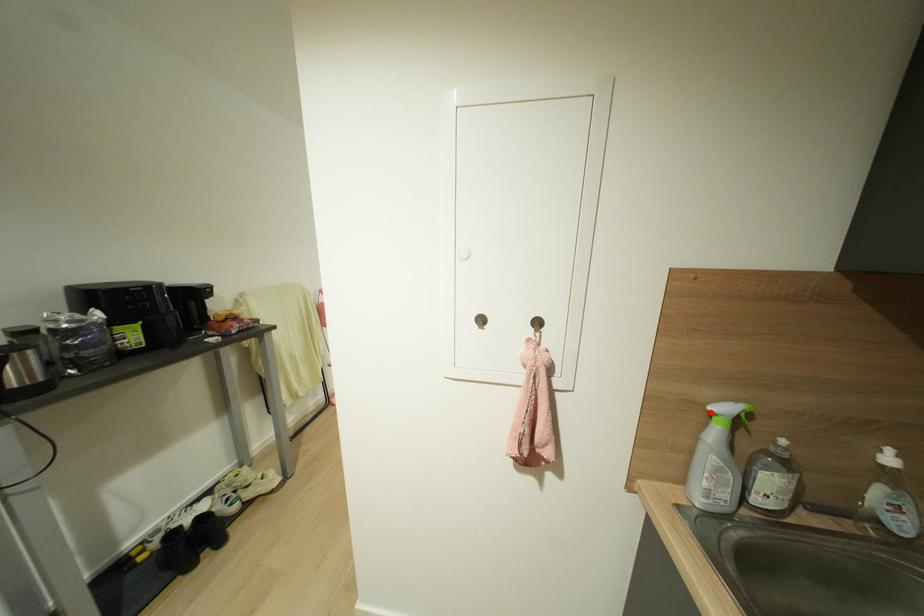
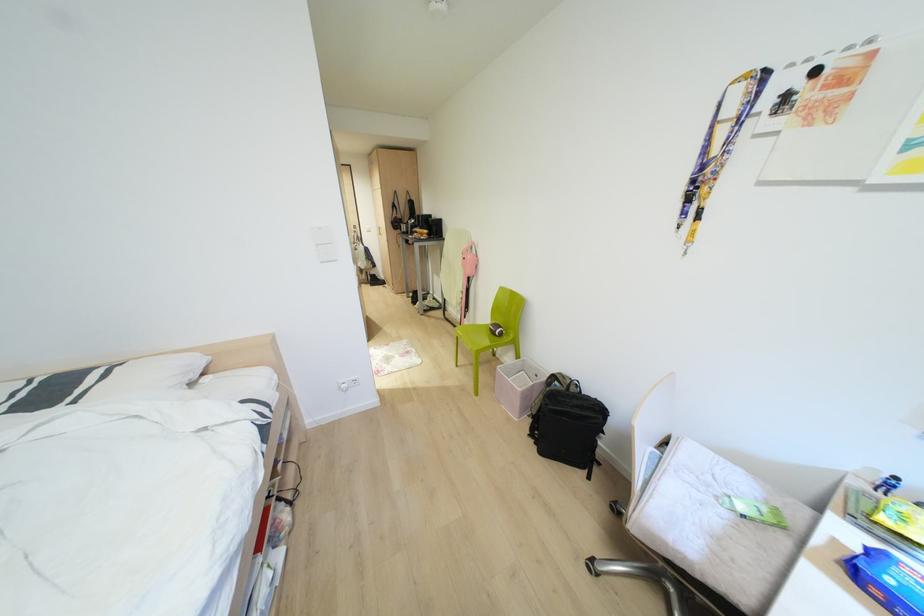
Question: I am providing you with two images of the same scene from different viewpoints. A red point is marked on the first image. At the location where the point appears in image 1, is it still visible in image 2?

Choices:
 (A) Yes
 (B) No

Answer: (B)